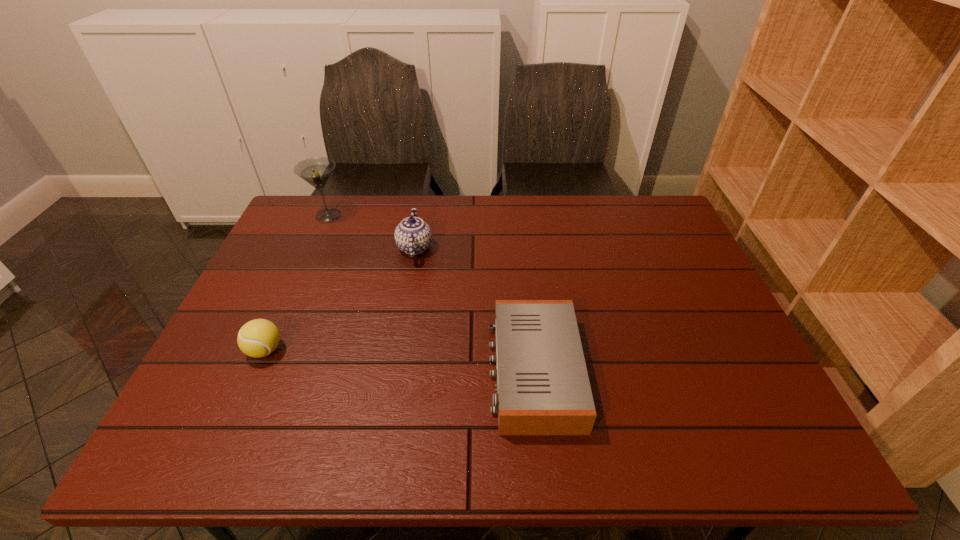
Where is `vacant space that is in between the shortest object and the tennis ball`? Image resolution: width=960 pixels, height=540 pixels. vacant space that is in between the shortest object and the tennis ball is located at coordinates (399, 361).

The width and height of the screenshot is (960, 540). What are the coordinates of `free space between the third tallest object and the radio receiver` in the screenshot? It's located at (399, 361).

Locate an element on the screen. vacant space that is in between the shortest object and the third tallest object is located at coordinates (399, 361).

You are a GUI agent. You are given a task and a screenshot of the screen. Output one action in this format:
    pyautogui.click(x=<x>, y=<y>)
    Task: Click on the empty location between the martini and the tennis ball
    This screenshot has height=540, width=960.
    Given the screenshot: What is the action you would take?
    pyautogui.click(x=297, y=283)

At what (x,y) coordinates should I click in order to perform the action: click on free space between the second farthest object and the radio receiver. Please return your answer as a coordinate pair (x, y). Looking at the image, I should click on (474, 309).

Image resolution: width=960 pixels, height=540 pixels. I want to click on object that ranks as the second closest to the shortest object, so 257,338.

Locate which object ranks third in proximity to the tennis ball. Please provide its 2D coordinates. Your answer should be formatted as a tuple, i.e. [(x, y)], where the tuple contains the x and y coordinates of a point satisfying the conditions above.

[(543, 388)]

The image size is (960, 540). Find the location of `free location that satisfies the following two spatial constraints: 1. on the back side of the tallest object; 2. on the right side of the tennis ball`. free location that satisfies the following two spatial constraints: 1. on the back side of the tallest object; 2. on the right side of the tennis ball is located at coordinates (324, 215).

The height and width of the screenshot is (540, 960). Identify the location of free space that satisfies the following two spatial constraints: 1. on the back side of the tallest object; 2. on the right side of the third tallest object. (324, 215).